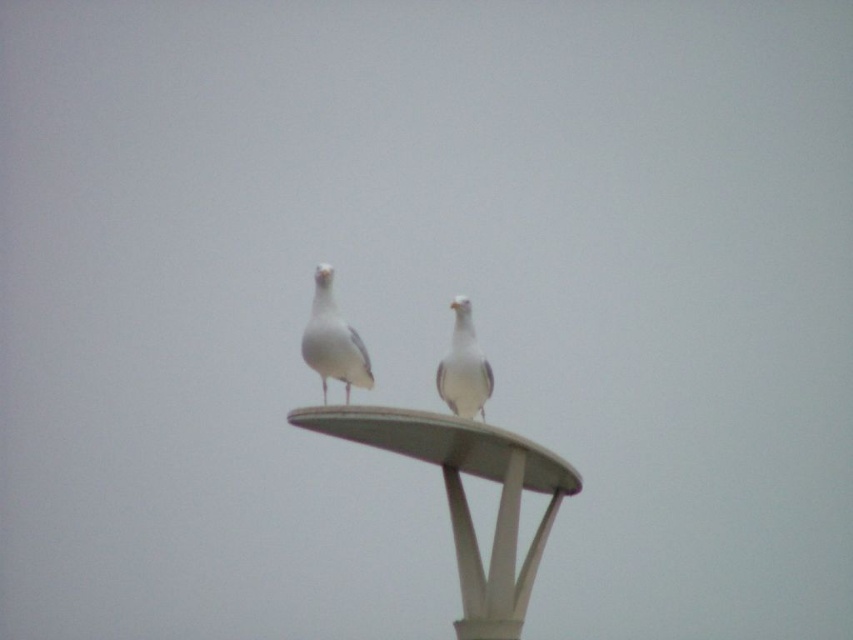
Question: Is white matte lamp post at center bigger than white matte bird at center?

Choices:
 (A) no
 (B) yes

Answer: (B)

Question: Considering the real-world distances, which object is closest to the white matte lamp post at center?

Choices:
 (A) white feathered bird at center
 (B) white matte bird at center

Answer: (A)

Question: Can you confirm if white matte bird at center is smaller than white feathered bird at center?

Choices:
 (A) no
 (B) yes

Answer: (B)

Question: Is white matte lamp post at center wider than white feathered bird at center?

Choices:
 (A) yes
 (B) no

Answer: (A)

Question: Estimate the real-world distances between objects in this image. Which object is closer to the white feathered bird at center?

Choices:
 (A) white matte bird at center
 (B) white matte lamp post at center

Answer: (B)

Question: Which of the following is the closest to the observer?

Choices:
 (A) (468, 364)
 (B) (556, 486)
 (C) (347, 364)

Answer: (C)